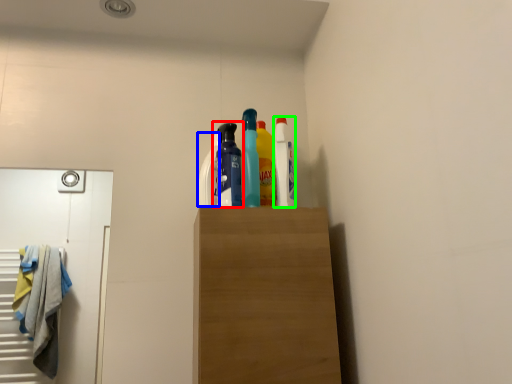
Question: Estimate the real-world distances between objects in this image. Which object is farther from bottle (highlighted by a red box), cleaning product (highlighted by a blue box) or cleaning product (highlighted by a green box)?

Choices:
 (A) cleaning product
 (B) cleaning product

Answer: (B)